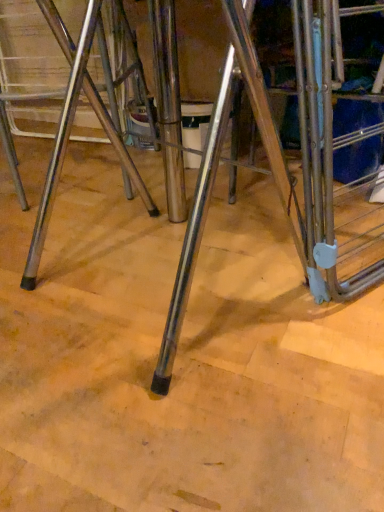
What is the approximate width of silver metallic ladder at center?

It is 8.86 inches.

What are the coordinates of `silver metallic ladder at center` in the screenshot? It's located at (320, 158).

The image size is (384, 512). What do you see at coordinates (320, 158) in the screenshot?
I see `silver metallic ladder at center` at bounding box center [320, 158].

Where is `silver metallic ladder at center`? Image resolution: width=384 pixels, height=512 pixels. silver metallic ladder at center is located at coordinates (320, 158).